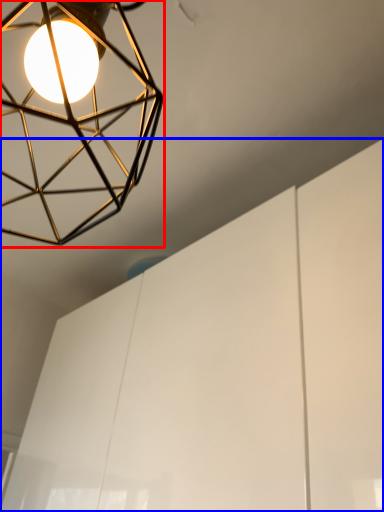
Question: Which object is closer to the camera taking this photo, lamp (highlighted by a red box) or cabinetry (highlighted by a blue box)?

Choices:
 (A) lamp
 (B) cabinetry

Answer: (A)